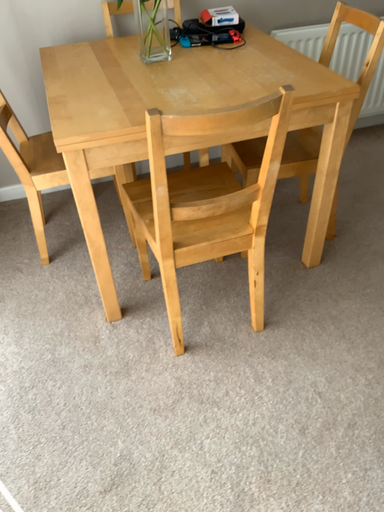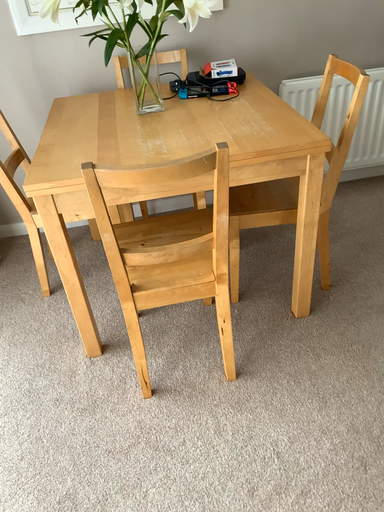
Question: How did the camera likely rotate when shooting the video?

Choices:
 (A) rotated right
 (B) rotated left

Answer: (B)